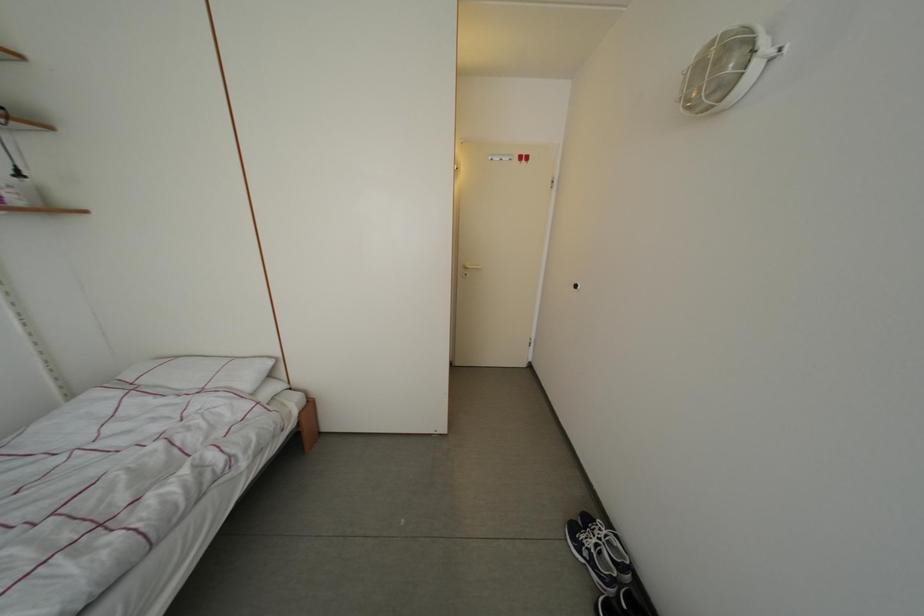
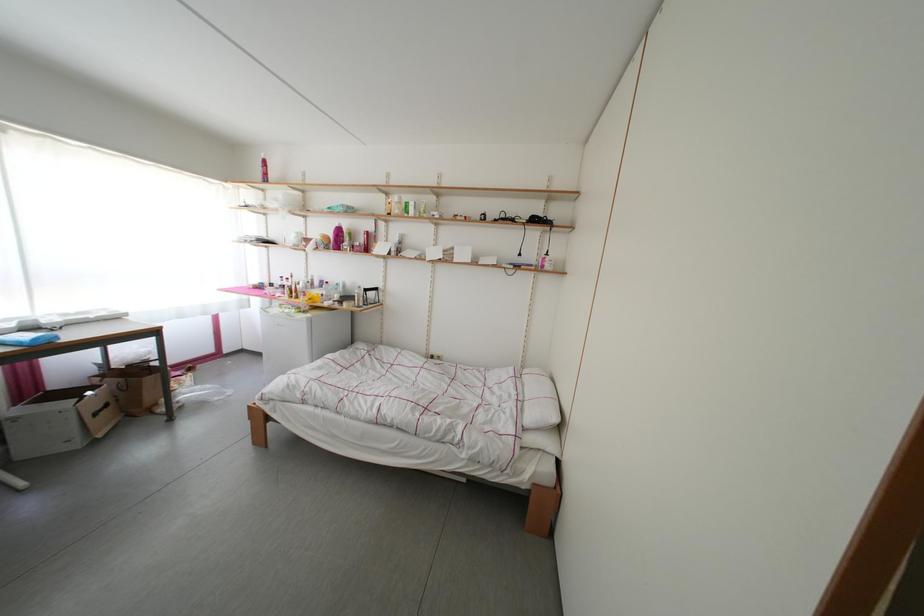
Question: The images are taken continuously from a first-person perspective. In which direction is your viewpoint rotating?

Choices:
 (A) Left
 (B) Right
 (C) Up
 (D) Down

Answer: (A)